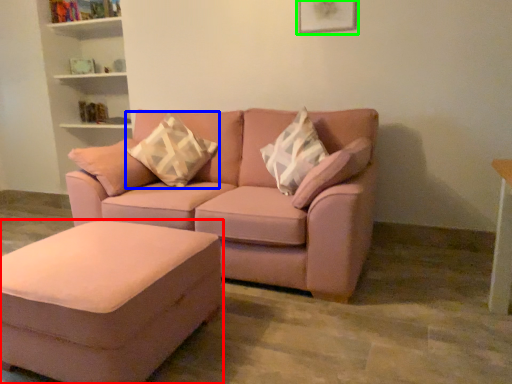
Question: Which is nearer to the table (highlighted by a red box)? pillow (highlighted by a blue box) or picture frame (highlighted by a green box).

Choices:
 (A) pillow
 (B) picture frame

Answer: (A)